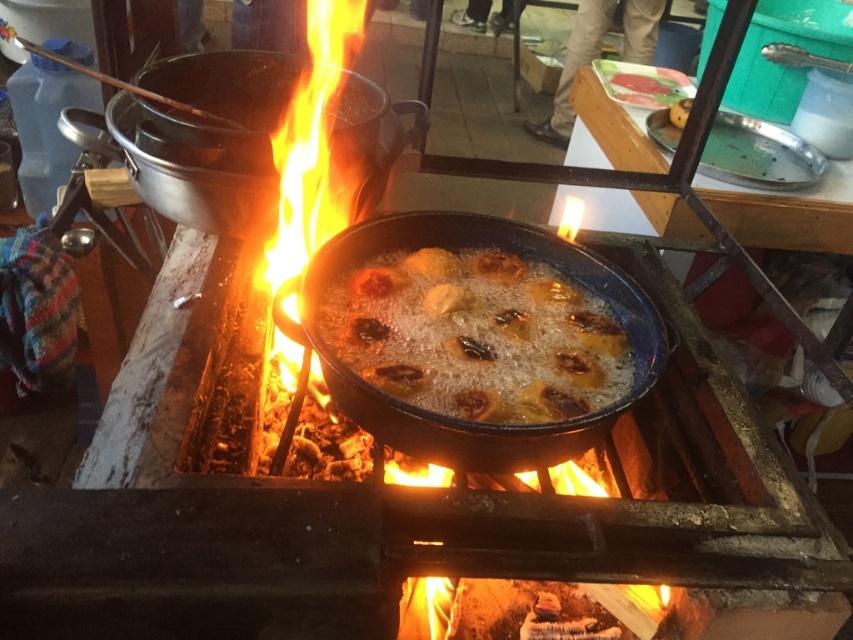
You are a chef trying to adjust the heat under the black cast iron frying pan at center and the bright orange flame at center. Which object should you move closer to the flame to increase the heat on the frying pan?

The black cast iron frying pan at center is to the left of the bright orange flame at center. To increase the heat on the frying pan, you should move the frying pan closer to the flame.